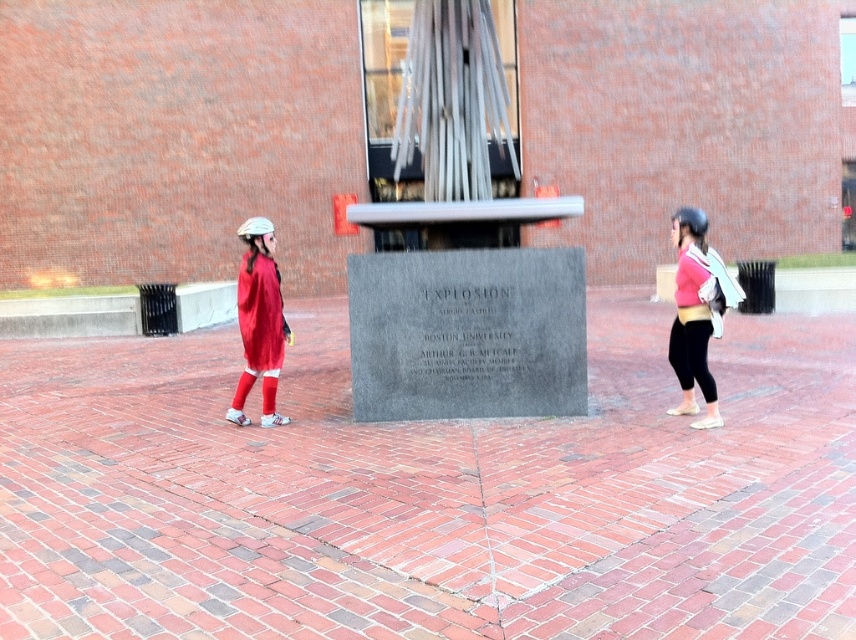
Can you confirm if matte red sweater at left is positioned to the left of pink fabric backpack at right?

Indeed, matte red sweater at left is positioned on the left side of pink fabric backpack at right.

In the scene shown: Does matte red sweater at left appear under pink fabric backpack at right?

Yes.

Between point (272, 413) and point (670, 412), which one is positioned behind?

The point (670, 412) is behind.

Find the location of `matte red sweater at left`. matte red sweater at left is located at coordinates (259, 321).